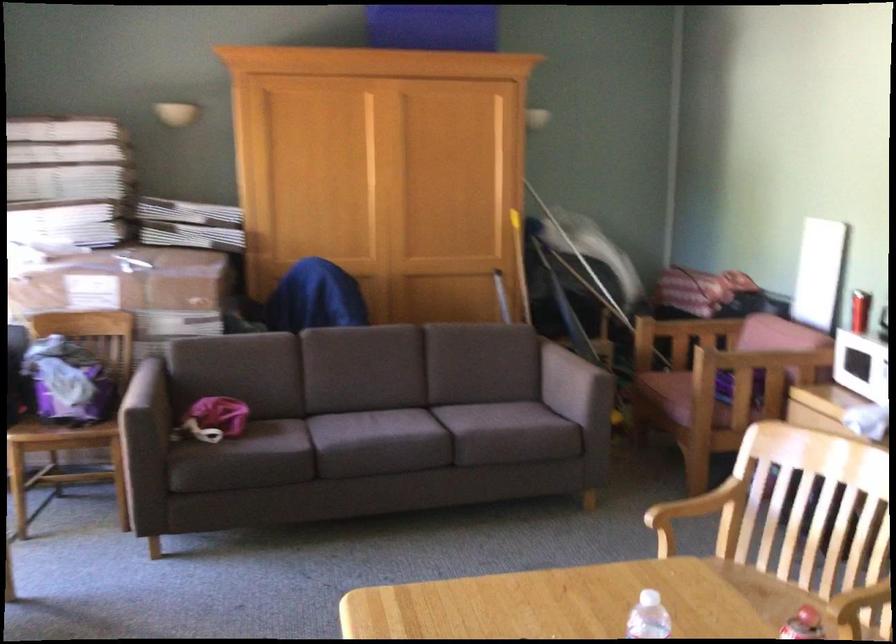
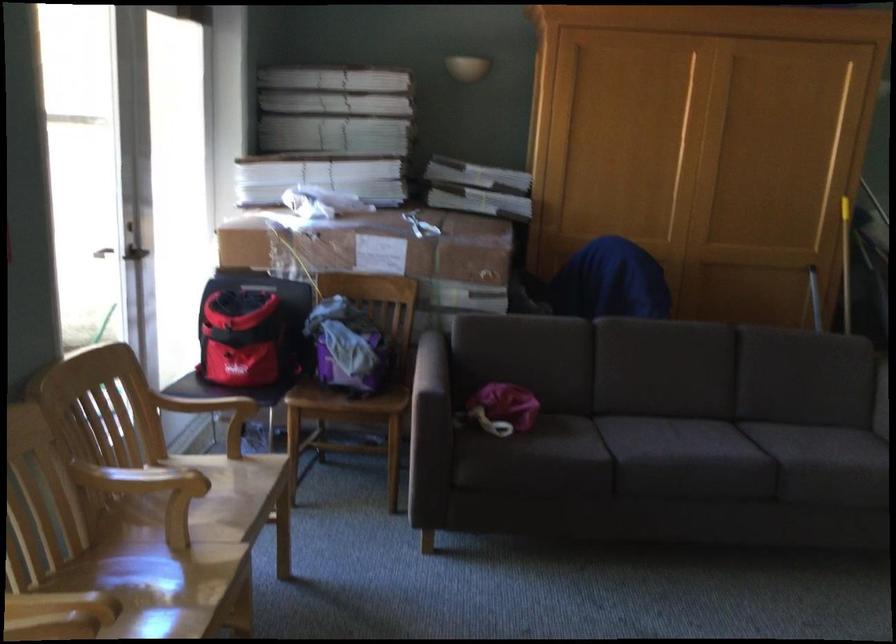
Locate, in the second image, the point that corresponds to point 74,401 in the first image.

(352, 366)